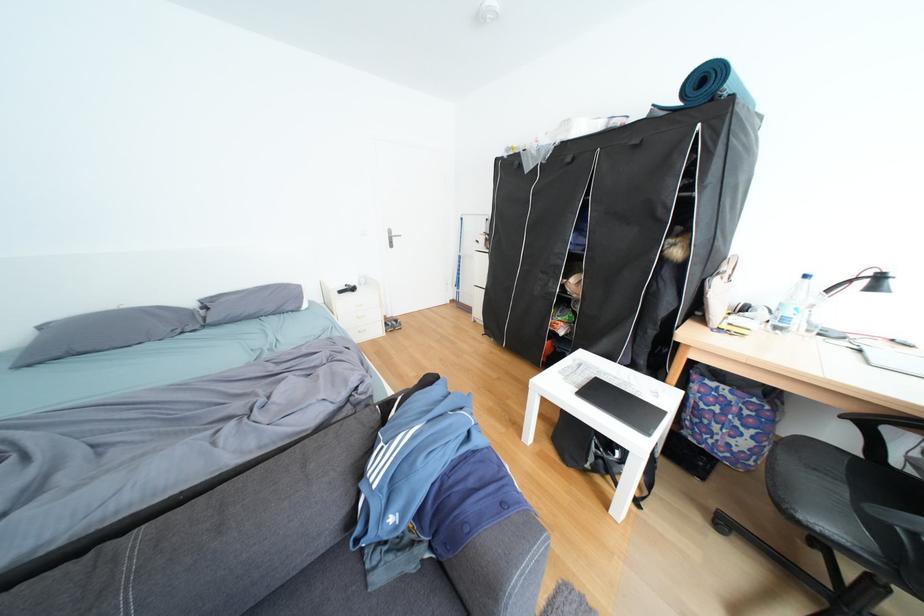
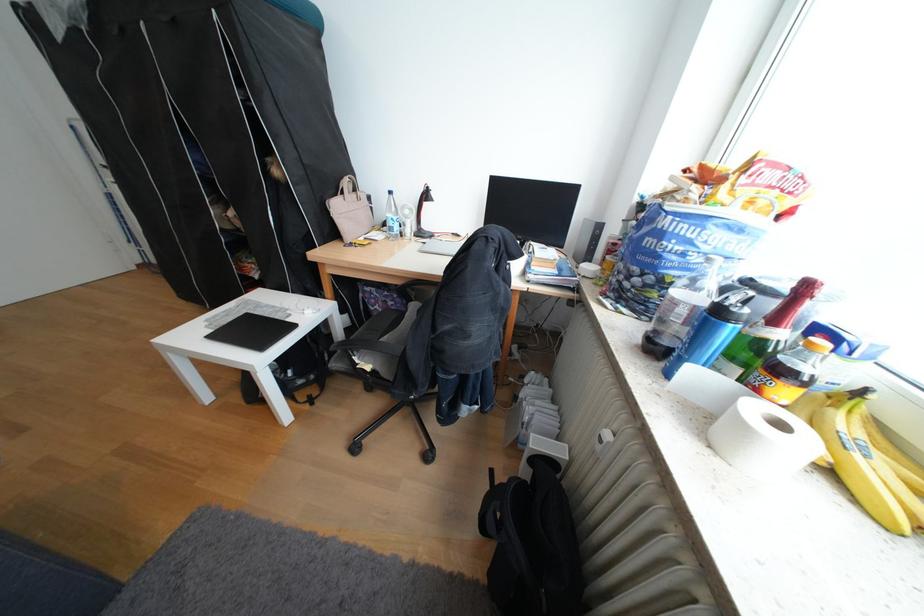
The first image is from the beginning of the video and the second image is from the end. How did the camera likely rotate when shooting the video?

The camera rotated toward right-down.